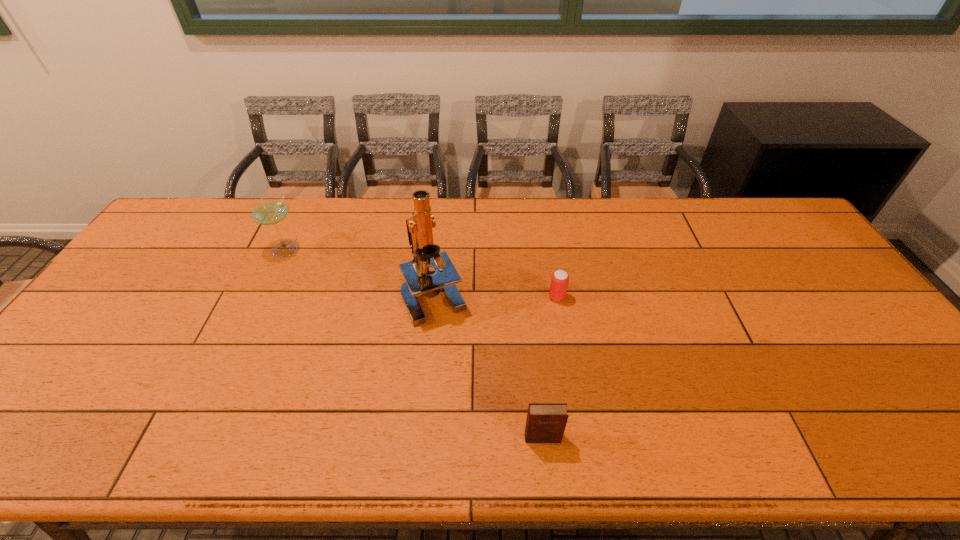
You are a GUI agent. You are given a task and a screenshot of the screen. Output one action in this format:
    pyautogui.click(x=<x>, y=<y>)
    Task: Click on the free spot located 0.080m on the right of the rightmost object
    This screenshot has width=960, height=540.
    Given the screenshot: What is the action you would take?
    pyautogui.click(x=593, y=298)

You are a GUI agent. You are given a task and a screenshot of the screen. Output one action in this format:
    pyautogui.click(x=<x>, y=<y>)
    Task: Click on the object at the far edge
    This screenshot has width=960, height=540.
    Given the screenshot: What is the action you would take?
    click(268, 211)

Locate an element on the screen. The image size is (960, 540). object at the near edge is located at coordinates [x=546, y=422].

At what (x,y) coordinates should I click in order to perform the action: click on free space at the far edge. Please return your answer as a coordinate pair (x, y). Looking at the image, I should click on (493, 204).

Image resolution: width=960 pixels, height=540 pixels. In the image, there is a desktop. What are the coordinates of `free space at the left edge` in the screenshot? It's located at [108, 357].

In order to click on vacant space at the far left corner in this screenshot , I will do `click(204, 212)`.

I want to click on free location at the near left corner, so click(x=40, y=428).

Where is `vacant area at the far right corner of the desktop`? vacant area at the far right corner of the desktop is located at coordinates (778, 211).

Where is `free spot between the diary and the leftmost object`? free spot between the diary and the leftmost object is located at coordinates (414, 344).

Where is `free space between the second object from right to left and the second tallest object`? This screenshot has height=540, width=960. free space between the second object from right to left and the second tallest object is located at coordinates (414, 344).